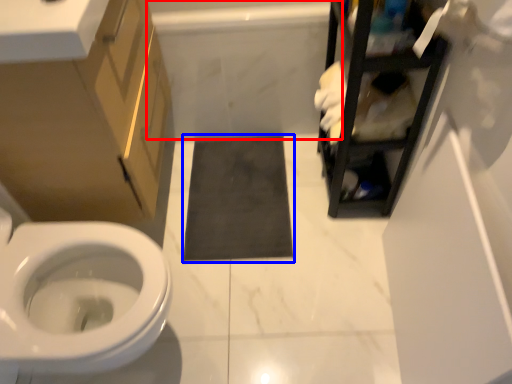
Question: Among these objects, which one is nearest to the camera, bath (highlighted by a red box) or bath mat (highlighted by a blue box)?

Choices:
 (A) bath
 (B) bath mat

Answer: (A)